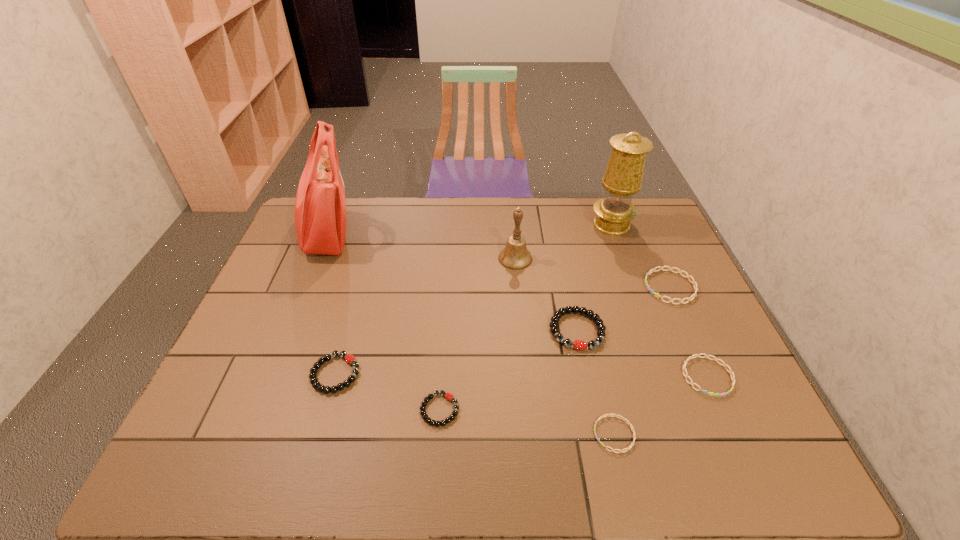
Where is `handbag`? Image resolution: width=960 pixels, height=540 pixels. handbag is located at coordinates (320, 208).

Locate an element on the screen. This screenshot has height=540, width=960. oil lamp is located at coordinates (623, 176).

Where is `the third tallest object`? Image resolution: width=960 pixels, height=540 pixels. the third tallest object is located at coordinates (515, 255).

Identify the location of bell. This screenshot has width=960, height=540. click(515, 255).

Find the location of a particular element. The width and height of the screenshot is (960, 540). the second farthest bracelet is located at coordinates (580, 345).

Where is `the fifth nearest object`? the fifth nearest object is located at coordinates (580, 345).

This screenshot has width=960, height=540. Identify the location of the sixth nearest object. (693, 282).

I want to click on the farthest bracelet, so click(693, 282).

This screenshot has width=960, height=540. I want to click on the leftmost black bracelet, so click(349, 358).

Where is `the leftmost bracelet`? the leftmost bracelet is located at coordinates (349, 358).